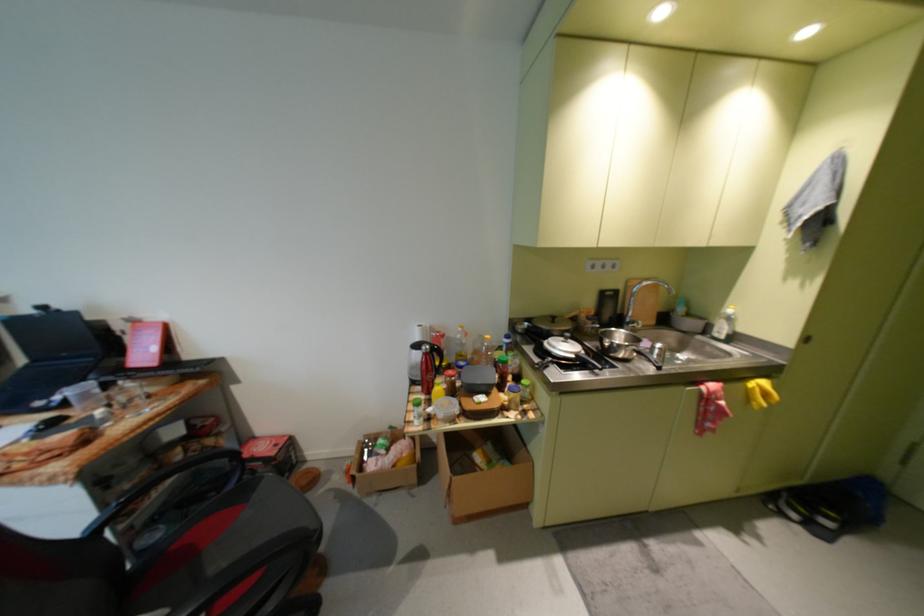
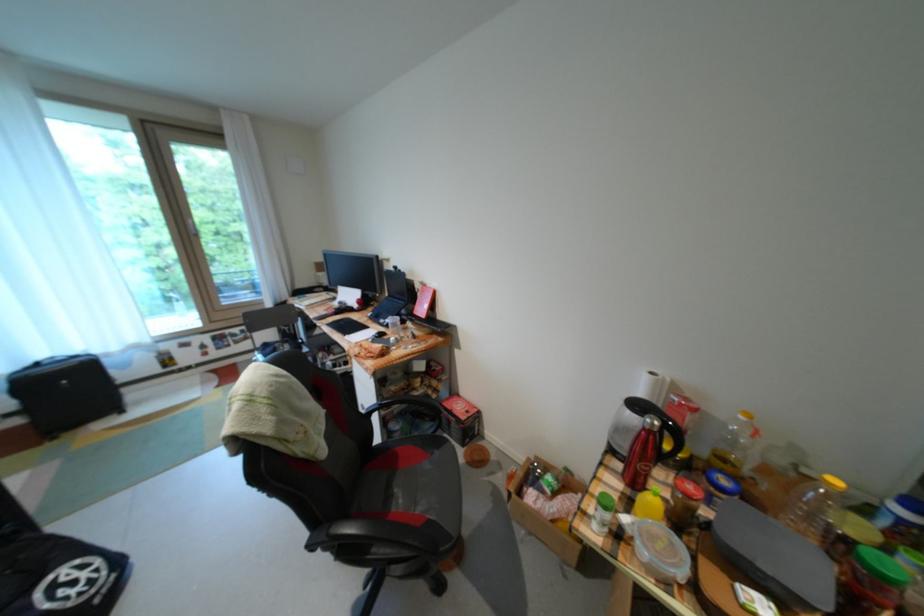
Find the pixel in the second image that matches [516,363] in the first image.

(898, 583)